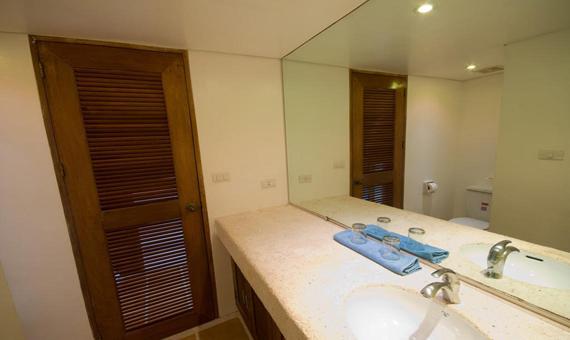
This screenshot has width=570, height=340. I want to click on reflection of toilet paper on holder, so click(431, 187).